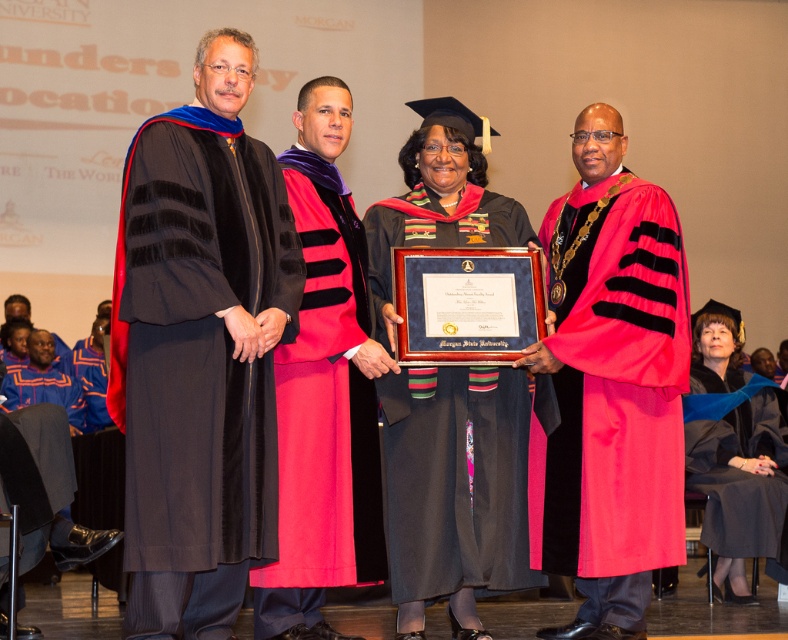
Which of these two, black velvet gown at center or velvet red gown at center, stands taller?

velvet red gown at center

Does black velvet gown at center have a lesser height compared to velvet red gown at center?

Indeed, black velvet gown at center has a lesser height compared to velvet red gown at center.

Who is more forward, (243, 401) or (298, 454)?

Point (243, 401)

Where is `black velvet gown at center`? Image resolution: width=788 pixels, height=640 pixels. black velvet gown at center is located at coordinates (197, 365).

Is black velvet gown at center thinner than matte black graduation gown at center?

Correct, black velvet gown at center's width is less than matte black graduation gown at center's.

Is point (217, 396) positioned behind point (749, 524)?

No.

Find the location of `black velvet gown at center`. black velvet gown at center is located at coordinates (197, 365).

Can you confirm if velvet red gown at center is thinner than matte black graduation gown at center?

Yes.

Does velvet red gown at center have a larger size compared to matte black graduation gown at center?

No.

Is point (311, 353) more distant than point (764, 433)?

No.

Locate an element on the screen. This screenshot has height=640, width=788. velvet red gown at center is located at coordinates (322, 416).